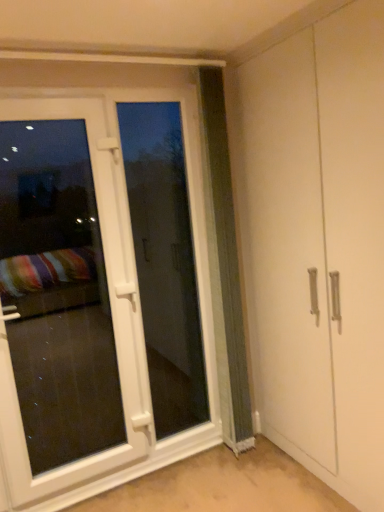
Question: Choose the correct answer: Is green textured curtain at center inside white glossy door at left or outside it?

Choices:
 (A) outside
 (B) inside

Answer: (A)

Question: From a real-world perspective, is green textured curtain at center above or below white glossy door at left?

Choices:
 (A) below
 (B) above

Answer: (B)

Question: Which object is the farthest from the white glossy door at left?

Choices:
 (A) white plastic screen door at left
 (B) green textured curtain at center

Answer: (B)

Question: Which object is positioned farthest from the white glossy door at left?

Choices:
 (A) green textured curtain at center
 (B) white plastic screen door at left

Answer: (A)